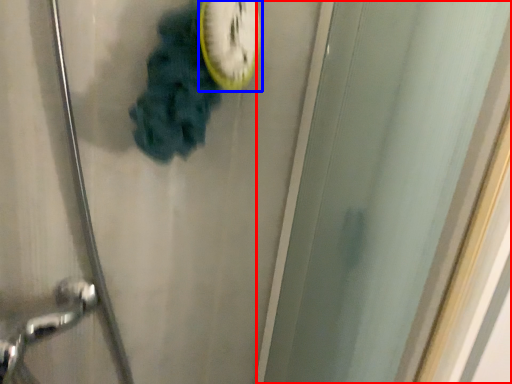
Question: Among these objects, which one is nearest to the camera, screen door (highlighted by a red box) or clock (highlighted by a blue box)?

Choices:
 (A) screen door
 (B) clock

Answer: (A)